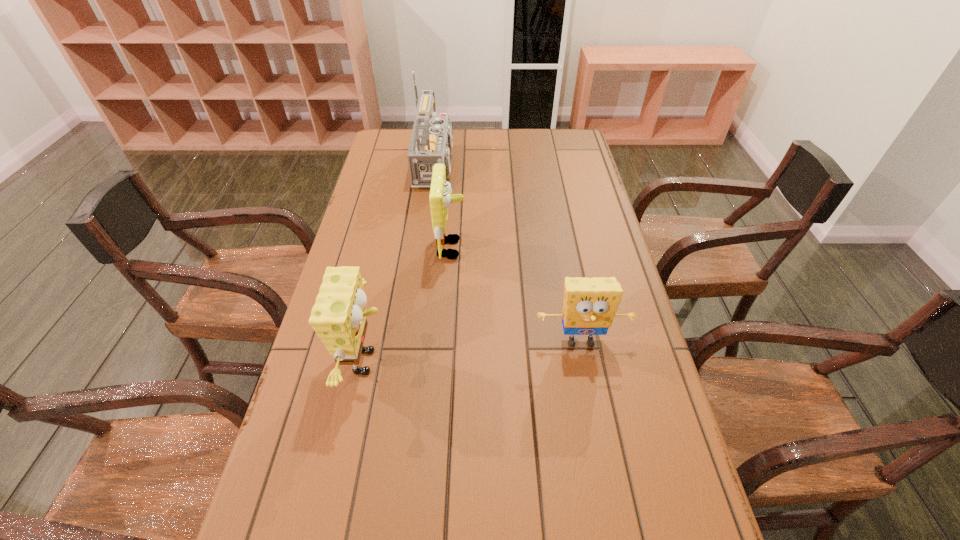
Identify which sponge is the closest to the leftmost sponge. Please provide its 2D coordinates. Your answer should be formatted as a tuple, i.e. [(x, y)], where the tuple contains the x and y coordinates of a point satisfying the conditions above.

[(440, 198)]

Identify the location of the closest sponge to the leftmost sponge. Image resolution: width=960 pixels, height=540 pixels. (440, 198).

Image resolution: width=960 pixels, height=540 pixels. Identify the location of free space that satisfies the following two spatial constraints: 1. on the face of the rightmost object; 2. on the front-facing side of the leftmost sponge. coord(585,362).

This screenshot has width=960, height=540. In order to click on free space that satisfies the following two spatial constraints: 1. on the face of the rightmost sponge; 2. on the front-facing side of the leftmost sponge in this screenshot , I will do `click(585, 362)`.